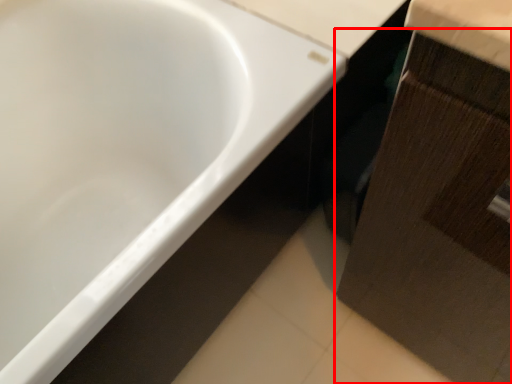
Question: From the image's perspective, where is cabinetry (annotated by the red box) located relative to bathtub?

Choices:
 (A) below
 (B) above

Answer: (A)